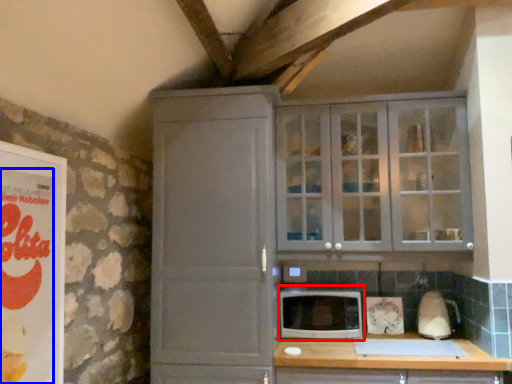
Question: Among these objects, which one is farthest to the camera, microwave oven (highlighted by a red box) or advertisement (highlighted by a blue box)?

Choices:
 (A) microwave oven
 (B) advertisement

Answer: (A)